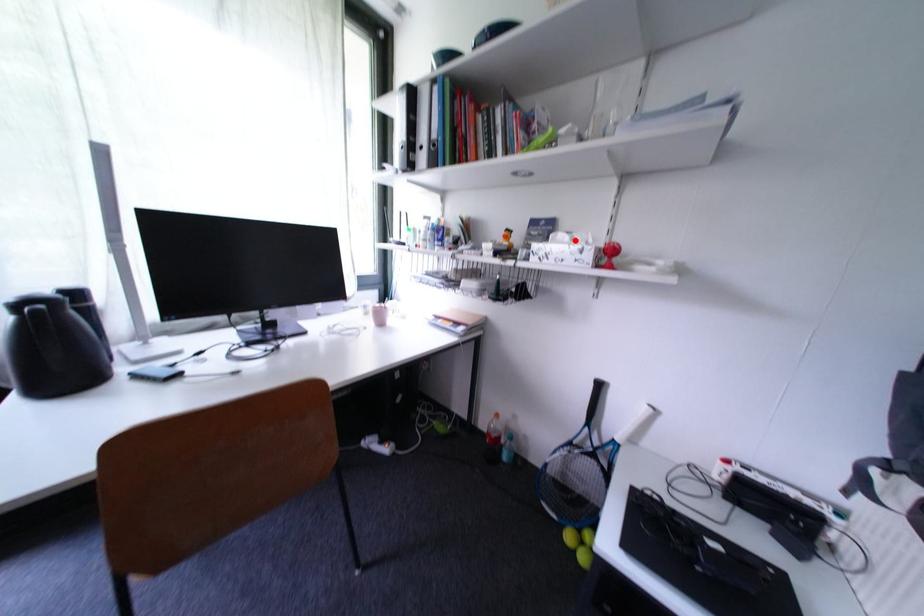
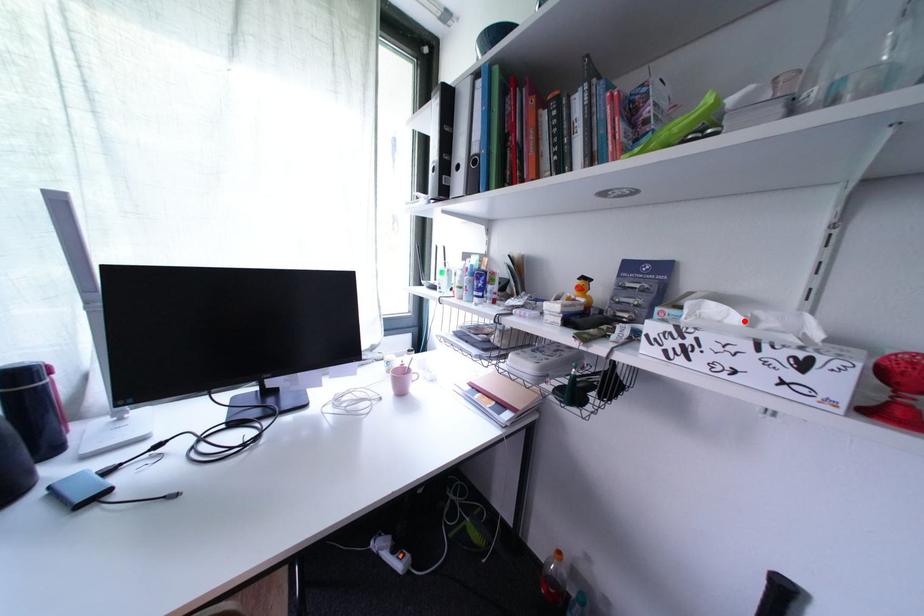
I am providing you with two images of the same scene from different viewpoints. A red point is marked on the first image and another point is marked on the second image. Is the red point in image1 aligned with the point shown in image2?

Yes